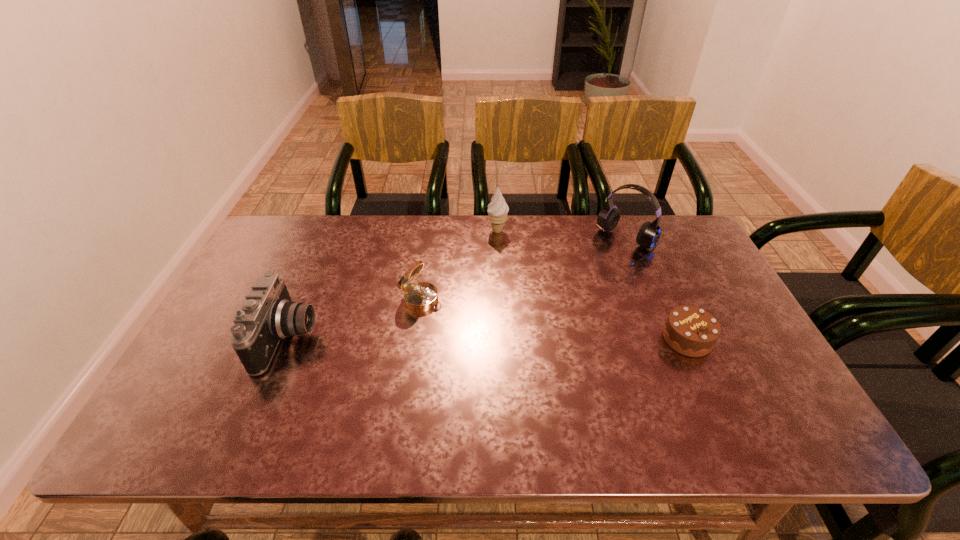
What are the coordinates of `object present at the left edge` in the screenshot? It's located at (267, 315).

This screenshot has width=960, height=540. I want to click on chocolate cake located in the right edge section of the desktop, so click(691, 331).

This screenshot has width=960, height=540. I want to click on headset situated at the right edge, so click(x=648, y=236).

You are a GUI agent. You are given a task and a screenshot of the screen. Output one action in this format:
    pyautogui.click(x=<x>, y=<y>)
    Task: Click on the object that is at the near left corner
    The width and height of the screenshot is (960, 540).
    Given the screenshot: What is the action you would take?
    pyautogui.click(x=267, y=315)

What are the coordinates of `object located in the far right corner section of the desktop` in the screenshot? It's located at (648, 236).

At what (x,y) coordinates should I click in order to perform the action: click on blank space at the far edge. Please return your answer as a coordinate pair (x, y). Image resolution: width=960 pixels, height=540 pixels. Looking at the image, I should click on (380, 220).

What are the coordinates of `free space at the near edge of the desktop` in the screenshot? It's located at (x=281, y=381).

In the image, there is a desktop. Identify the location of free space at the left edge. This screenshot has height=540, width=960. (276, 261).

In the image, there is a desktop. At what (x,y) coordinates should I click in order to perform the action: click on vacant area at the right edge. Please return your answer as a coordinate pair (x, y). The height and width of the screenshot is (540, 960). Looking at the image, I should click on (719, 370).

Find the location of a particular element. The height and width of the screenshot is (540, 960). free space at the far left corner is located at coordinates (277, 228).